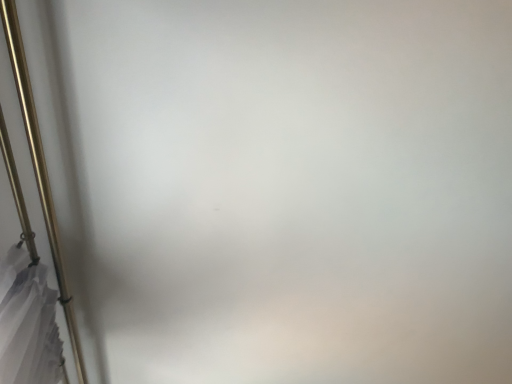
Measure the distance between point (x=31, y=153) and camera.

Point (x=31, y=153) and camera are 35.98 inches apart from each other.

This screenshot has height=384, width=512. What do you see at coordinates (39, 168) in the screenshot? I see `gold metallic pipe at left` at bounding box center [39, 168].

In order to face gold metallic pipe at left, should I rotate leftwards or rightwards?

To align with it, rotate left about 24.661°.

You are a GUI agent. You are given a task and a screenshot of the screen. Output one action in this format:
    pyautogui.click(x=<x>, y=<y>)
    Task: Click on the gold metallic pipe at left
    This screenshot has height=384, width=512.
    Given the screenshot: What is the action you would take?
    pyautogui.click(x=39, y=168)

Where is `gold metallic pipe at left`? The width and height of the screenshot is (512, 384). gold metallic pipe at left is located at coordinates [39, 168].